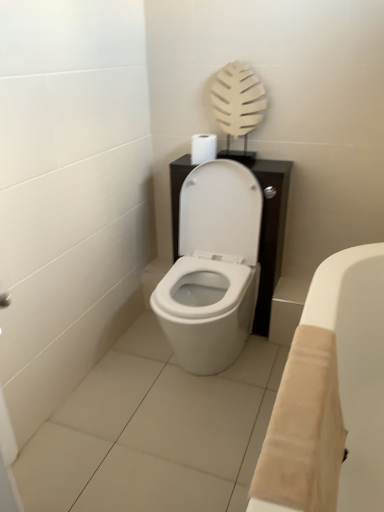
At what (x,y) coordinates should I click in order to perform the action: click on free space above beige fabric bath at lower right (from a real-world perspective). Please return your answer as a coordinate pair (x, y). Looking at the image, I should click on (298, 404).